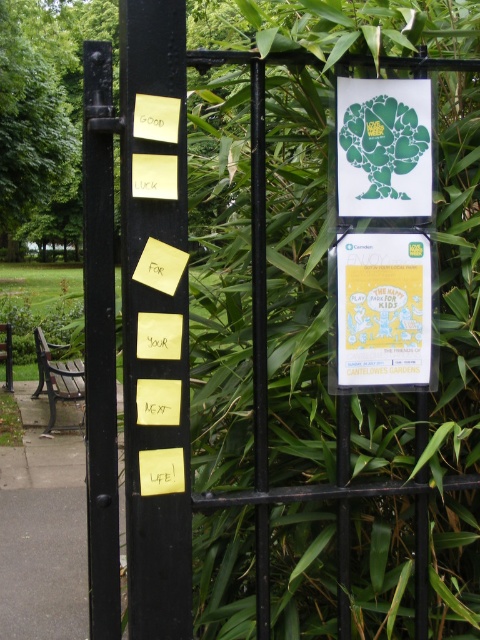
You are standing in front of the black metal gate described. There are two points marked on the gate. The first point is at coordinates point (111, 573) and the second is at point (389, 180). Which point is closer to you?

Point (111, 573) is in front of point (389, 180), so it is closer to you.

In the scene shown: You are standing in front of the black metal gate described. There are two points marked on the gate. The first point is at coordinates point (177, 284) and the second point is at point (361, 282). Which point is closer to you?

Point (177, 284) is closer to you because it is in front of point (361, 282).